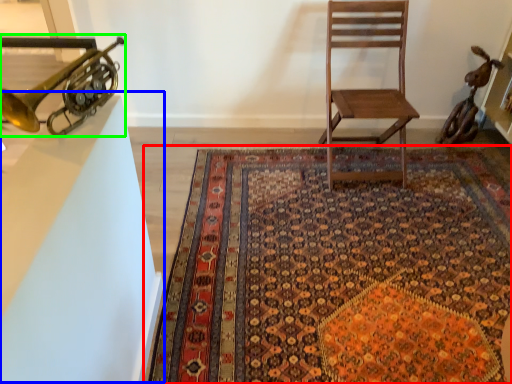
Question: Estimate the real-world distances between objects in this image. Which object is closer to mat (highlighted by a red box), table (highlighted by a blue box) or trumpet (highlighted by a green box)?

Choices:
 (A) table
 (B) trumpet

Answer: (A)